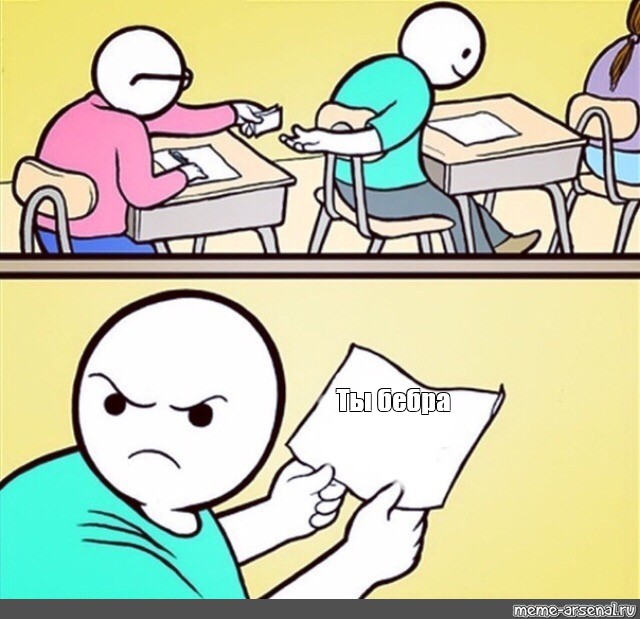
This screenshot has height=619, width=640. What are the coordinates of `top of the rounded center back of the chair on the left` in the screenshot? It's located at (49, 191).